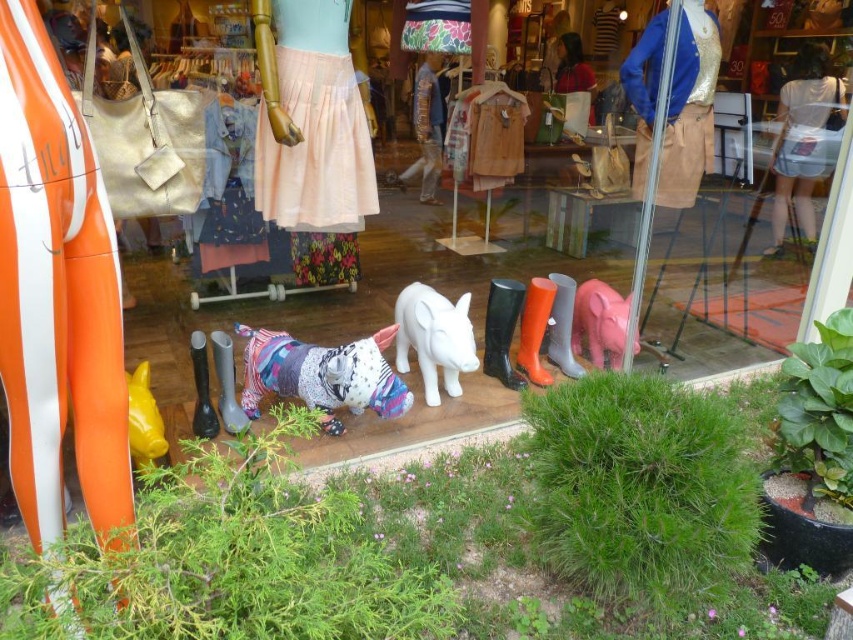
You are a customer standing in front of the store window. You notice two points marked on the window display. The first point is at coordinate point[434,291] and the second is at point[798,81]. Which point is closer to you?

Point[434,291] is closer to you than point[798,81].

From the picture: You are standing in front of the store window and see two points marked on the glass. The first point is at coordinate point(270,380) and the second is at point(432,56). Which point is closer to you?

Point(270,380) is in front of point(432,56), so it is closer to you.